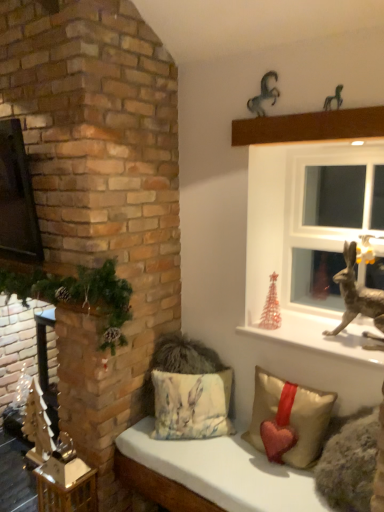
Question: From a real-world perspective, relative to translucent glass christmas tree at right, which ranks as the first christmas decoration in right-to-left order, is shiny metallic reindeer at right vertically above or below?

Choices:
 (A) above
 (B) below

Answer: (A)

Question: From the image's perspective, is shiny metallic reindeer at right located above or below translucent glass christmas tree at right, which is the first christmas decoration from back to front?

Choices:
 (A) below
 (B) above

Answer: (B)

Question: Estimate the real-world distances between objects in this image. Which object is farther from the translucent glass christmas tree at right, the 2th christmas decoration positioned from the front?

Choices:
 (A) beige fabric pillow with heart at lower center, the 2th pillow viewed from the left
 (B) metallic silver horse at upper center, which is the 2th animal in front-to-back order
 (C) white plastic window at upper right
 (D) metallic gold statue at upper right
 (E) metallic brown ledge at upper center

Answer: (B)

Question: Which object is the farthest from the metallic horse at upper right, which is the 1th animal in front-to-back order?

Choices:
 (A) fluffy beige cushion with rabbit print at lower center, the first pillow viewed from the left
 (B) metallic gold statue at upper right
 (C) white plastic window at upper right
 (D) fluffy fabric cushion at lower center
 (E) beige fabric pillow with heart at lower center, the 2th pillow viewed from the left

Answer: (D)